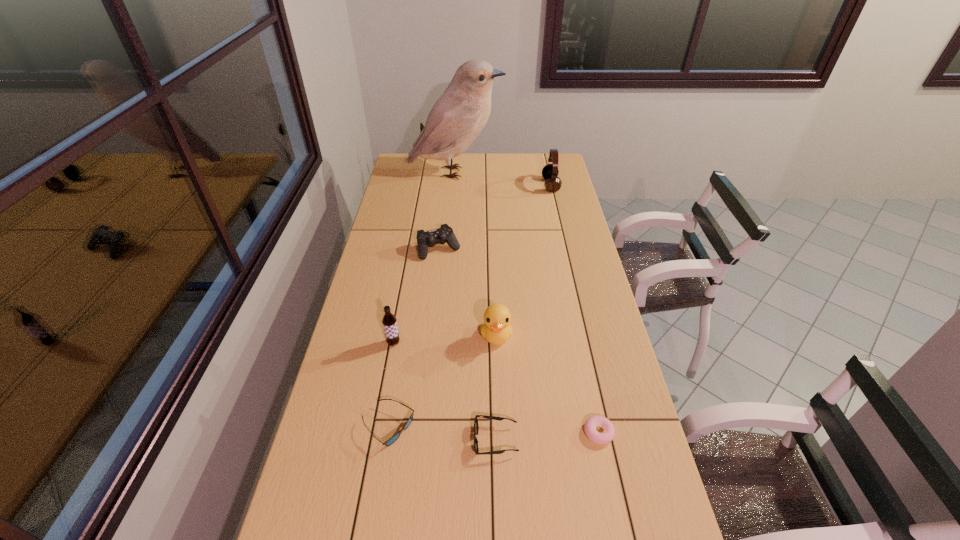
Locate an element on the screen. empty space between the headset and the root beer is located at coordinates (472, 264).

This screenshot has height=540, width=960. Identify the location of object that is the fourth nearest to the fourth tallest object. (607, 435).

Select which object is the fifth closest to the root beer. Please provide its 2D coordinates. Your answer should be formatted as a tuple, i.e. [(x, y)], where the tuple contains the x and y coordinates of a point satisfying the conditions above.

[(607, 435)]

Image resolution: width=960 pixels, height=540 pixels. I want to click on free space that satisfies the following two spatial constraints: 1. on the front side of the fifth tallest object; 2. at the front of the left sunglasses showing the lenses, so click(420, 427).

Locate an element on the screen. Image resolution: width=960 pixels, height=540 pixels. free spot that satisfies the following two spatial constraints: 1. on the front side of the control; 2. at the front of the left sunglasses showing the lenses is located at coordinates (420, 427).

Where is `free space that satisfies the following two spatial constraints: 1. on the face of the duck; 2. at the front of the left sunglasses showing the lenses`? free space that satisfies the following two spatial constraints: 1. on the face of the duck; 2. at the front of the left sunglasses showing the lenses is located at coordinates (499, 427).